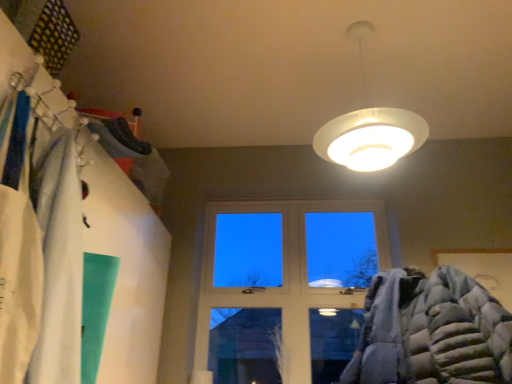
Question: From the image's perspective, does white glossy lampshade at upper center appear higher than transparent glass window at center?

Choices:
 (A) no
 (B) yes

Answer: (B)

Question: From a real-world perspective, is white glossy lampshade at upper center located beneath transparent glass window at center?

Choices:
 (A) no
 (B) yes

Answer: (A)

Question: Considering the relative sizes of white glossy lampshade at upper center and transparent glass window at center in the image provided, is white glossy lampshade at upper center bigger than transparent glass window at center?

Choices:
 (A) no
 (B) yes

Answer: (B)

Question: Is white glossy lampshade at upper center next to transparent glass window at center?

Choices:
 (A) no
 (B) yes

Answer: (A)

Question: Does white glossy lampshade at upper center have a smaller size compared to transparent glass window at center?

Choices:
 (A) no
 (B) yes

Answer: (A)

Question: Are white glossy lampshade at upper center and transparent glass window at center far apart?

Choices:
 (A) yes
 (B) no

Answer: (A)

Question: Can you confirm if transparent glass window at center is wider than white glossy lampshade at upper center?

Choices:
 (A) yes
 (B) no

Answer: (B)

Question: Is transparent glass window at center touching white glossy lampshade at upper center?

Choices:
 (A) yes
 (B) no

Answer: (B)

Question: Is transparent glass window at center not within white glossy lampshade at upper center?

Choices:
 (A) no
 (B) yes

Answer: (B)

Question: Does transparent glass window at center have a greater height compared to white glossy lampshade at upper center?

Choices:
 (A) no
 (B) yes

Answer: (B)

Question: Is transparent glass window at center thinner than white glossy lampshade at upper center?

Choices:
 (A) yes
 (B) no

Answer: (A)

Question: Considering the relative sizes of transparent glass window at center and white glossy lampshade at upper center in the image provided, is transparent glass window at center smaller than white glossy lampshade at upper center?

Choices:
 (A) yes
 (B) no

Answer: (A)

Question: From the image's perspective, is transparent glass window at center positioned above or below white glossy lampshade at upper center?

Choices:
 (A) above
 (B) below

Answer: (B)